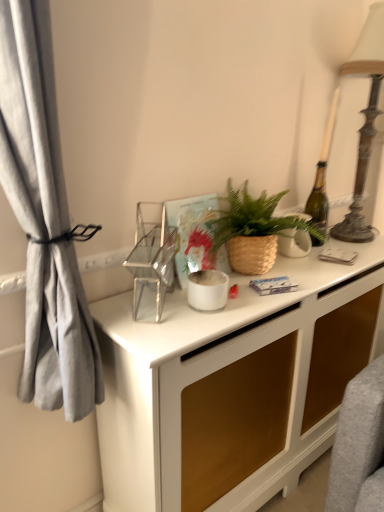
Where is `white matte pot at center, which is the 2th appliance in right-to-left order`? The image size is (384, 512). white matte pot at center, which is the 2th appliance in right-to-left order is located at coordinates (207, 290).

What do you see at coordinates (294, 243) in the screenshot?
I see `white ceramic vase at center, the 3th appliance when ordered from left to right` at bounding box center [294, 243].

What do you see at coordinates (233, 385) in the screenshot?
I see `white glossy desk at center` at bounding box center [233, 385].

Find the location of a particular element. Image resolution: width=384 pixels, height=512 pixels. white matte pot at center, positioned as the second appliance in back-to-front order is located at coordinates (207, 290).

From a real-world perspective, which is physically above, brown woven basket at center or antique bronze table lamp at right?

antique bronze table lamp at right.

In the image, is brown woven basket at center on the left side or the right side of antique bronze table lamp at right?

brown woven basket at center is positioned on antique bronze table lamp at right's left side.

Between point (297, 252) and point (219, 276), which one is positioned behind?

The point (297, 252) is farther from the camera.

In the scene shown: Who is bigger, white ceramic vase at center, marked as the 1th appliance in a right-to-left arrangement, or white matte pot at center, marked as the second appliance in a front-to-back arrangement?

white ceramic vase at center, marked as the 1th appliance in a right-to-left arrangement, is bigger.

Looking at their sizes, would you say white ceramic vase at center, marked as the 1th appliance in a right-to-left arrangement, is wider or thinner than white matte pot at center, acting as the 2th appliance starting from the left?

white ceramic vase at center, marked as the 1th appliance in a right-to-left arrangement, is thinner than white matte pot at center, acting as the 2th appliance starting from the left.

Which object is positioned more to the right, clear glass shelf at center, the first appliance viewed from the front, or antique bronze table lamp at right?

From the viewer's perspective, antique bronze table lamp at right appears more on the right side.

Is clear glass shelf at center, which is the third appliance from back to front, located outside antique bronze table lamp at right?

Indeed, clear glass shelf at center, which is the third appliance from back to front, is completely outside antique bronze table lamp at right.

Who is taller, clear glass shelf at center, placed as the first appliance when sorted from left to right, or antique bronze table lamp at right?

With more height is antique bronze table lamp at right.

Is clear glass shelf at center, which is the third appliance from back to front, with antique bronze table lamp at right?

No, clear glass shelf at center, which is the third appliance from back to front, is not beside antique bronze table lamp at right.

From a real-world perspective, which is physically below, white ceramic vase at center, which is counted as the third appliance, starting from the front, or white glossy desk at center?

In real-world perspective, white glossy desk at center is lower.

Considering the relative sizes of white ceramic vase at center, which is counted as the third appliance, starting from the front, and white glossy desk at center in the image provided, is white ceramic vase at center, which is counted as the third appliance, starting from the front, shorter than white glossy desk at center?

Yes, white ceramic vase at center, which is counted as the third appliance, starting from the front, is shorter than white glossy desk at center.

Does white ceramic vase at center, which is counted as the third appliance, starting from the front, have a lesser width compared to white glossy desk at center?

Indeed, white ceramic vase at center, which is counted as the third appliance, starting from the front, has a lesser width compared to white glossy desk at center.

Is white glossy desk at center at the back of white ceramic vase at center, which is counted as the third appliance, starting from the front?

white ceramic vase at center, which is counted as the third appliance, starting from the front, does not have its back to white glossy desk at center.

From the image's perspective, relative to white matte pot at center, marked as the second appliance in a front-to-back arrangement, is clear glass shelf at center, which is the third appliance from back to front, above or below?

From the image's perspective, clear glass shelf at center, which is the third appliance from back to front, appears above white matte pot at center, marked as the second appliance in a front-to-back arrangement.

Measure the distance from clear glass shelf at center, which is the third appliance from back to front, to white matte pot at center, marked as the second appliance in a front-to-back arrangement.

5.12 inches.

Is clear glass shelf at center, the first appliance viewed from the front, not close to white matte pot at center, positioned as the second appliance in back-to-front order?

No, clear glass shelf at center, the first appliance viewed from the front, is not far from white matte pot at center, positioned as the second appliance in back-to-front order.

Considering the relative sizes of clear glass shelf at center, positioned as the 3th appliance in right-to-left order, and white matte pot at center, marked as the second appliance in a front-to-back arrangement, in the image provided, is clear glass shelf at center, positioned as the 3th appliance in right-to-left order, bigger than white matte pot at center, marked as the second appliance in a front-to-back arrangement,?

Yes.

Between brown woven basket at center and white matte pot at center, marked as the second appliance in a front-to-back arrangement, which one has smaller width?

white matte pot at center, marked as the second appliance in a front-to-back arrangement, is thinner.

Between brown woven basket at center and white matte pot at center, which is the 2th appliance in right-to-left order, which one appears on the right side from the viewer's perspective?

brown woven basket at center.

Which of these two, brown woven basket at center or white matte pot at center, which is the 2th appliance in right-to-left order, is bigger?

brown woven basket at center.

From the image's perspective, which one is positioned higher, brown woven basket at center or white matte pot at center, acting as the 2th appliance starting from the left?

brown woven basket at center.

Considering the sizes of antique bronze table lamp at right and brown woven basket at center in the image, is antique bronze table lamp at right bigger or smaller than brown woven basket at center?

Clearly, antique bronze table lamp at right is larger in size than brown woven basket at center.

Considering the points (356, 190) and (245, 191), which point is in front, point (356, 190) or point (245, 191)?

The point (245, 191) is closer.

Is antique bronze table lamp at right situated inside brown woven basket at center or outside?

antique bronze table lamp at right is spatially situated outside brown woven basket at center.

From the image's perspective, is antique bronze table lamp at right located beneath brown woven basket at center?

No, from the image's perspective, antique bronze table lamp at right is not below brown woven basket at center.

Locate an element on the screen. This screenshot has height=512, width=384. table lamp that is behind the brown woven basket at center is located at coordinates (365, 120).

Locate an element on the screen. appliance that is the 1st one when counting forward from the white ceramic vase at center, positioned as the first appliance in back-to-front order is located at coordinates (207, 290).

Which object lies nearer to the anchor point white glossy desk at center, clear glass shelf at center, placed as the first appliance when sorted from left to right, or white ceramic vase at center, the 3th appliance when ordered from left to right?

clear glass shelf at center, placed as the first appliance when sorted from left to right, is closer to white glossy desk at center.

Based on their spatial positions, is white ceramic vase at center, which is counted as the third appliance, starting from the front, or antique bronze table lamp at right further from clear glass shelf at center, placed as the first appliance when sorted from left to right?

antique bronze table lamp at right.

From the image, which object appears to be nearer to clear glass shelf at center, which is the third appliance from back to front, antique bronze table lamp at right or white matte pot at center, which is the 2th appliance in right-to-left order?

white matte pot at center, which is the 2th appliance in right-to-left order, lies closer to clear glass shelf at center, which is the third appliance from back to front, than the other object.

Based on their spatial positions, is white glossy desk at center or white matte pot at center, marked as the second appliance in a front-to-back arrangement, further from white ceramic vase at center, marked as the 1th appliance in a right-to-left arrangement?

Based on the image, white glossy desk at center appears to be further to white ceramic vase at center, marked as the 1th appliance in a right-to-left arrangement.

Estimate the real-world distances between objects in this image. Which object is further from clear glass shelf at center, positioned as the 3th appliance in right-to-left order, brown woven basket at center or white glossy desk at center?

Among the two, white glossy desk at center is located further to clear glass shelf at center, positioned as the 3th appliance in right-to-left order.

Considering their positions, is white ceramic vase at center, which is counted as the third appliance, starting from the front, positioned closer to clear glass shelf at center, the first appliance viewed from the front, than brown woven basket at center?

brown woven basket at center.

Which object lies nearer to the anchor point brown woven basket at center, clear glass shelf at center, the first appliance viewed from the front, or white matte pot at center, which is the 2th appliance in right-to-left order?

The object closer to brown woven basket at center is white matte pot at center, which is the 2th appliance in right-to-left order.

In the scene shown: Estimate the real-world distances between objects in this image. Which object is closer to brown woven basket at center, antique bronze table lamp at right or white glossy desk at center?

white glossy desk at center is closer to brown woven basket at center.

Where is `appliance between brown woven basket at center and antique bronze table lamp at right in the horizontal direction`? This screenshot has width=384, height=512. appliance between brown woven basket at center and antique bronze table lamp at right in the horizontal direction is located at coordinates (294, 243).

The image size is (384, 512). Identify the location of houseplant between clear glass shelf at center, positioned as the 3th appliance in right-to-left order, and antique bronze table lamp at right. (254, 230).

What are the coordinates of `appliance between clear glass shelf at center, the first appliance viewed from the front, and white glossy desk at center vertically` in the screenshot? It's located at (207, 290).

Where is `houseplant between clear glass shelf at center, placed as the first appliance when sorted from left to right, and white ceramic vase at center, which is counted as the third appliance, starting from the front, from left to right`? houseplant between clear glass shelf at center, placed as the first appliance when sorted from left to right, and white ceramic vase at center, which is counted as the third appliance, starting from the front, from left to right is located at coordinates (254, 230).